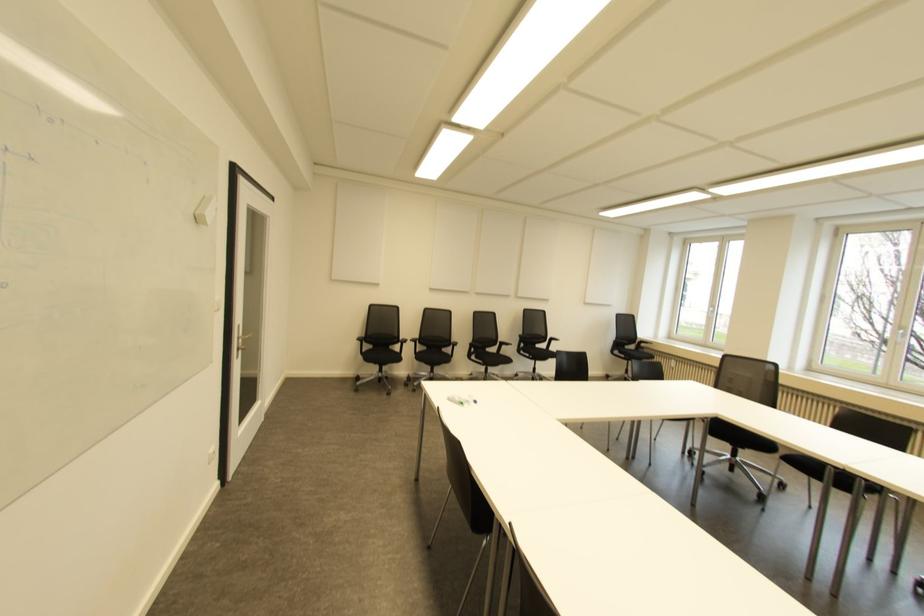
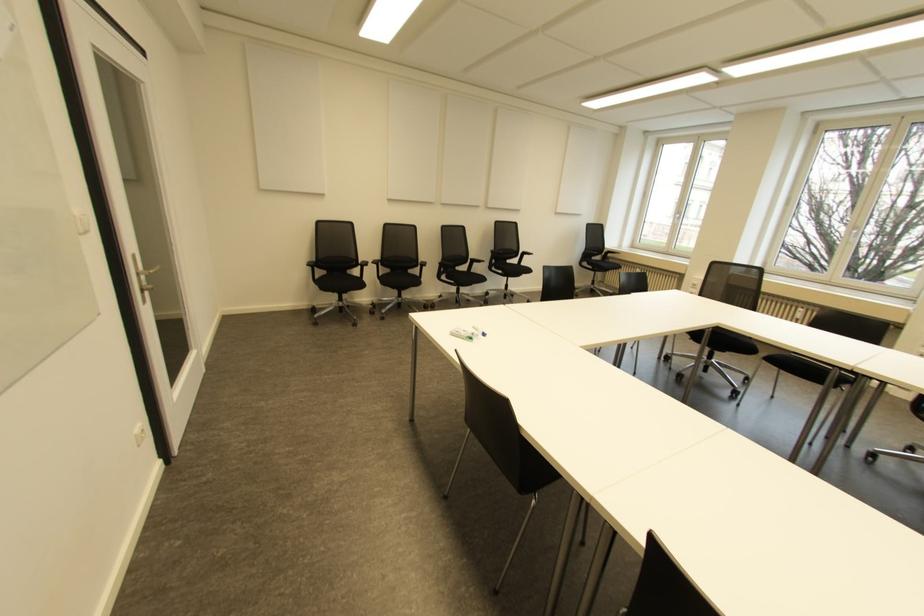
Which direction would the cameraman need to move to produce the second image?

The cameraman moved toward left, forward.